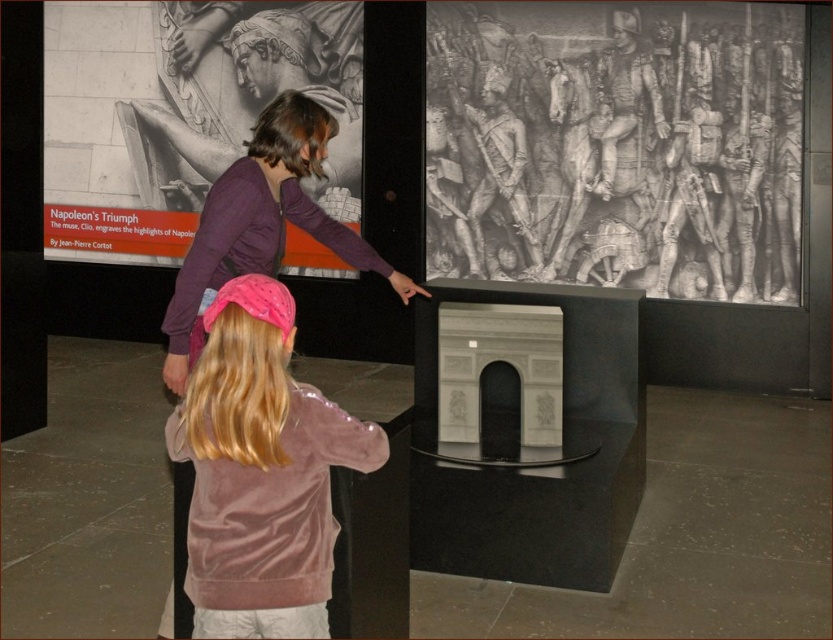
Question: Among these points, which one is nearest to the camera?

Choices:
 (A) (220, 520)
 (B) (764, 97)
 (C) (197, 125)

Answer: (A)

Question: Estimate the real-world distances between objects in this image. Which object is closer to the velvet pink jacket at lower center?

Choices:
 (A) pink velvet headband at upper center
 (B) matte gray stone arch at upper center
 (C) gray stone relief at upper right

Answer: (A)

Question: Does gray stone relief at upper right appear under matte gray stone arch at upper center?

Choices:
 (A) yes
 (B) no

Answer: (A)

Question: Is the position of velvet pink jacket at lower center less distant than that of pink velvet headband at upper center?

Choices:
 (A) yes
 (B) no

Answer: (A)

Question: Which of these objects is positioned farthest from the gray stone relief at upper right?

Choices:
 (A) velvet pink jacket at lower center
 (B) matte gray stone arch at upper center
 (C) pink velvet headband at upper center

Answer: (A)

Question: Does velvet pink jacket at lower center have a larger size compared to pink velvet headband at upper center?

Choices:
 (A) yes
 (B) no

Answer: (B)